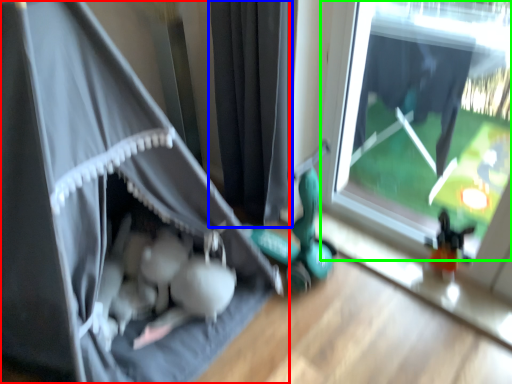
Question: Which object is the farthest from curtain (highlighted by a red box)? Choose among these: curtain (highlighted by a blue box) or window (highlighted by a green box).

Choices:
 (A) curtain
 (B) window

Answer: (B)